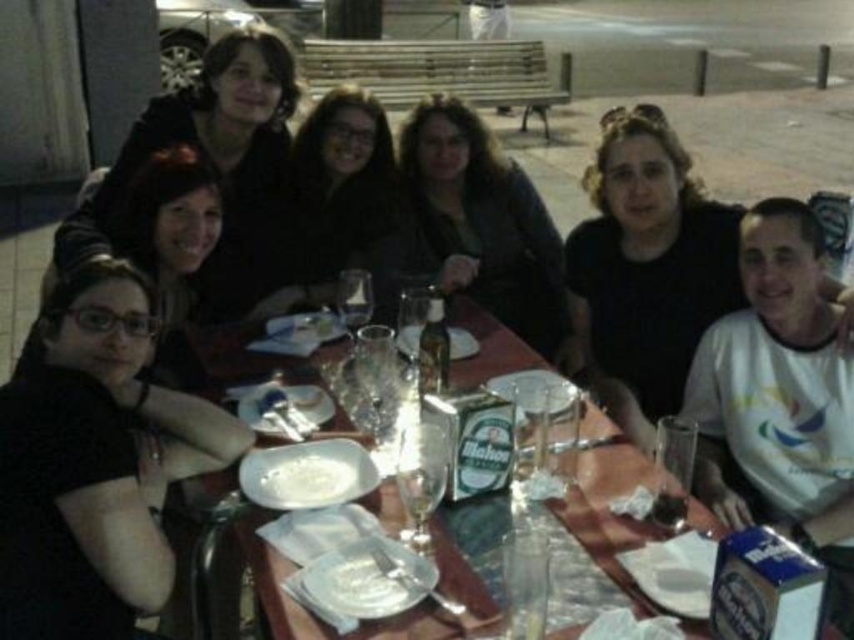
Looking at this image, can you confirm if black matte shirt at lower left is wider than dark brown leather jacket at center?

No, black matte shirt at lower left is not wider than dark brown leather jacket at center.

Who is positioned more to the left, black matte shirt at lower left or dark brown leather jacket at center?

black matte shirt at lower left

Does point (34, 602) come farther from viewer compared to point (399, 259)?

No, (34, 602) is closer to viewer.

Where is `black matte shirt at lower left`? The width and height of the screenshot is (854, 640). black matte shirt at lower left is located at coordinates (95, 465).

Does dark brown leather jacket at center appear under white creamy food at center?

No.

This screenshot has height=640, width=854. What do you see at coordinates (478, 225) in the screenshot?
I see `dark brown leather jacket at center` at bounding box center [478, 225].

Image resolution: width=854 pixels, height=640 pixels. In order to click on dark brown leather jacket at center in this screenshot , I will do `click(478, 225)`.

Find the location of `dark brown leather jacket at center`. dark brown leather jacket at center is located at coordinates (478, 225).

Who is lower down, black matte shirt at lower left or matte black jacket at center?

Positioned lower is black matte shirt at lower left.

Is point (38, 636) less distant than point (370, 214)?

Yes, point (38, 636) is closer to viewer.

Between point (3, 577) and point (322, 141), which one is positioned behind?

The point (322, 141) is more distant.

Find the location of a particular element. black matte shirt at lower left is located at coordinates (95, 465).